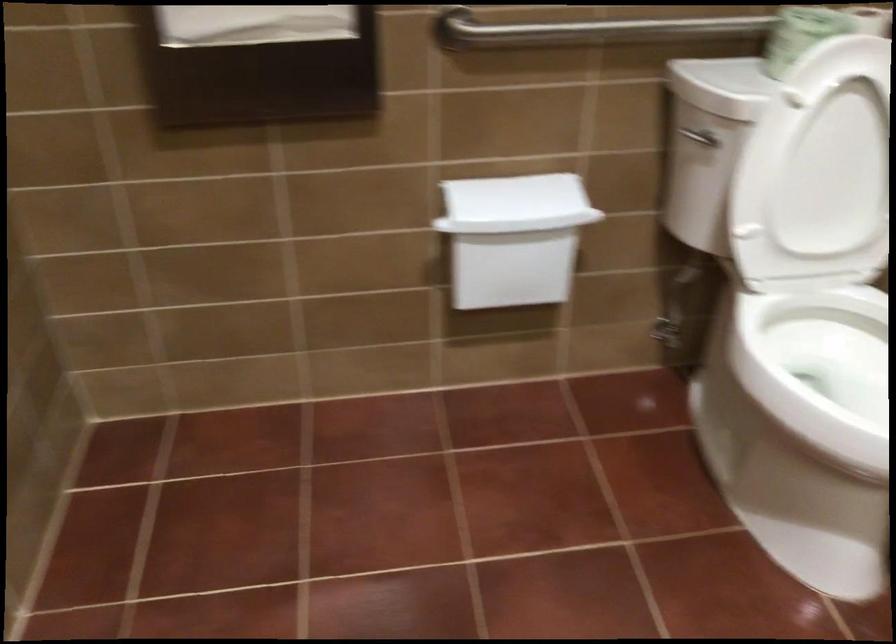
You are a GUI agent. You are given a task and a screenshot of the screen. Output one action in this format:
    pyautogui.click(x=<x>, y=<y>)
    Task: Click on the toilet paper dispenser
    The width and height of the screenshot is (896, 644).
    Given the screenshot: What is the action you would take?
    pyautogui.click(x=512, y=269)